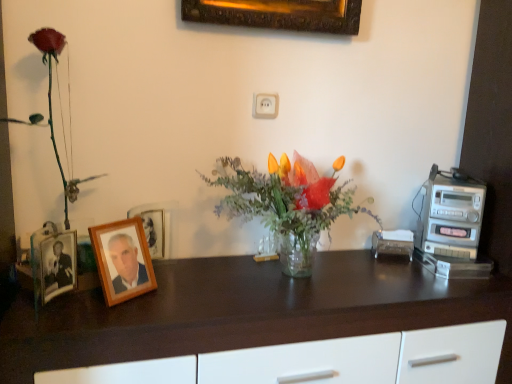
Locate an element on the screen. empty space that is in between clear glass vase at center and wooden photo frame at left, the 2th picture frame when ordered from back to front is located at coordinates (177, 291).